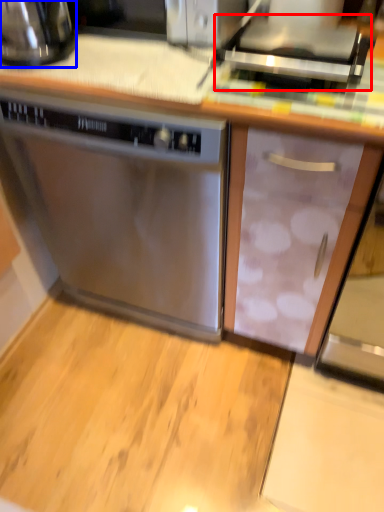
Question: Which object is further to the camera taking this photo, appliance (highlighted by a red box) or kitchen appliance (highlighted by a blue box)?

Choices:
 (A) appliance
 (B) kitchen appliance

Answer: (B)